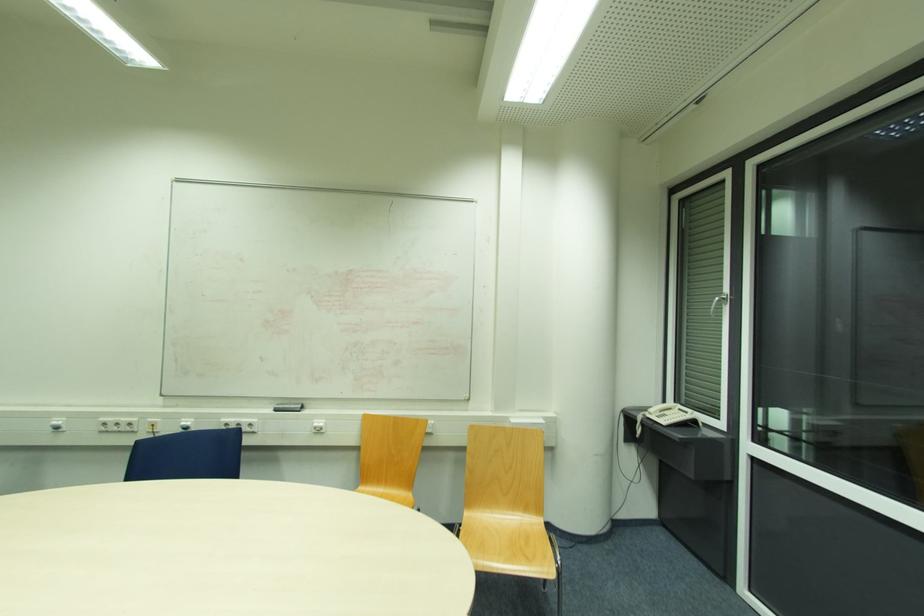
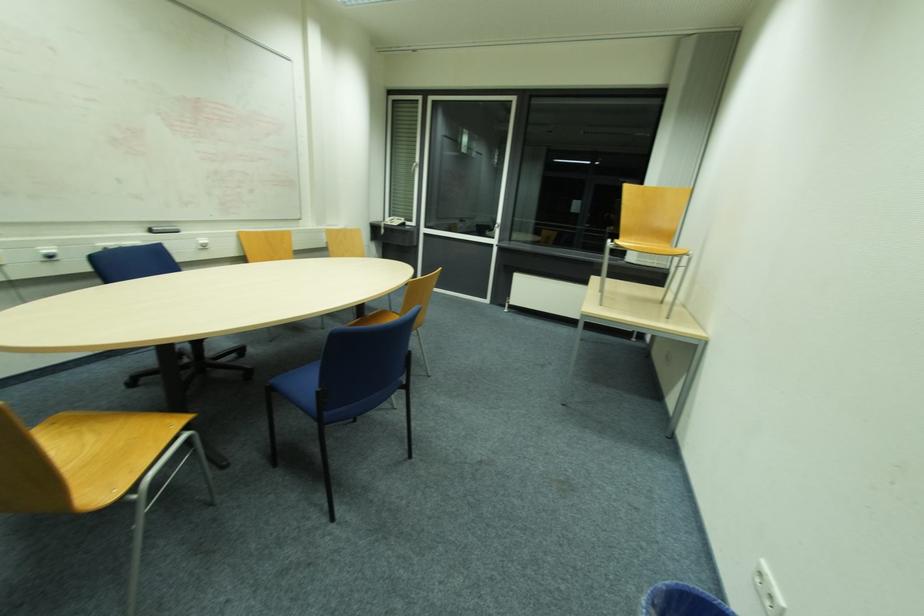
In the second image, find the point that corresponds to (x=281, y=402) in the first image.

(151, 227)